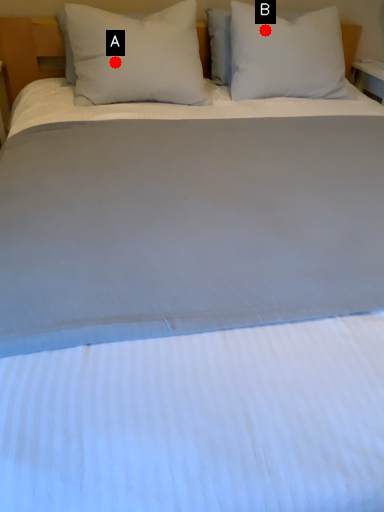
Question: Two points are circled on the image, labeled by A and B beside each circle. Which point is farther to the camera?

Choices:
 (A) A is further
 (B) B is further

Answer: (B)